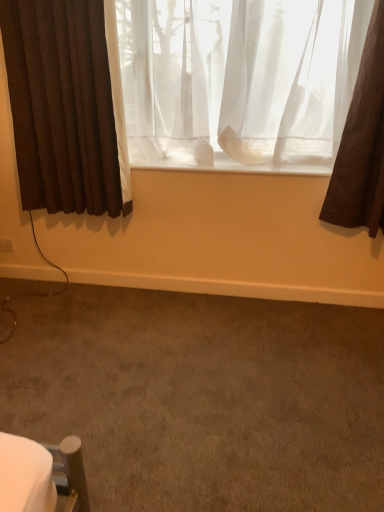
Question: Is white plastic electric outlet at lower left at the left side of sheer white curtain at center, which is counted as the 1th curtain, starting from the right?

Choices:
 (A) no
 (B) yes

Answer: (B)

Question: From a real-world perspective, is white plastic electric outlet at lower left physically below sheer white curtain at center, which is counted as the 1th curtain, starting from the right?

Choices:
 (A) no
 (B) yes

Answer: (B)

Question: Does white plastic electric outlet at lower left have a larger size compared to sheer white curtain at center, placed as the second curtain when sorted from left to right?

Choices:
 (A) no
 (B) yes

Answer: (A)

Question: Is white plastic electric outlet at lower left taller than sheer white curtain at center, which is counted as the 1th curtain, starting from the right?

Choices:
 (A) yes
 (B) no

Answer: (B)

Question: Does white plastic electric outlet at lower left appear on the right side of sheer white curtain at center, which is counted as the 1th curtain, starting from the right?

Choices:
 (A) yes
 (B) no

Answer: (B)

Question: Considering their positions, is brown carpet at lower center located in front of or behind sheer white curtain at center, which is counted as the 1th curtain, starting from the right?

Choices:
 (A) behind
 (B) front

Answer: (B)

Question: Is point (294, 321) closer or farther from the camera than point (314, 150)?

Choices:
 (A) farther
 (B) closer

Answer: (A)

Question: Would you say brown carpet at lower center is inside or outside sheer white curtain at center, which is counted as the 1th curtain, starting from the right?

Choices:
 (A) outside
 (B) inside

Answer: (A)

Question: Is brown carpet at lower center wider or thinner than sheer white curtain at center, which is counted as the 1th curtain, starting from the right?

Choices:
 (A) wide
 (B) thin

Answer: (A)

Question: In terms of width, does brown carpet at lower center look wider or thinner when compared to white plastic electric outlet at lower left?

Choices:
 (A) wide
 (B) thin

Answer: (A)

Question: From a real-world perspective, relative to white plastic electric outlet at lower left, is brown carpet at lower center vertically above or below?

Choices:
 (A) above
 (B) below

Answer: (B)

Question: In the image, is brown carpet at lower center positioned in front of or behind white plastic electric outlet at lower left?

Choices:
 (A) front
 (B) behind

Answer: (A)

Question: Based on their sizes in the image, would you say brown carpet at lower center is bigger or smaller than white plastic electric outlet at lower left?

Choices:
 (A) small
 (B) big

Answer: (B)

Question: Is brown carpet at lower center situated inside brown fabric curtain at left, marked as the 2th curtain in a right-to-left arrangement, or outside?

Choices:
 (A) inside
 (B) outside

Answer: (B)

Question: From the image's perspective, is brown carpet at lower center located above or below brown fabric curtain at left, arranged as the first curtain when viewed from the left?

Choices:
 (A) below
 (B) above

Answer: (A)